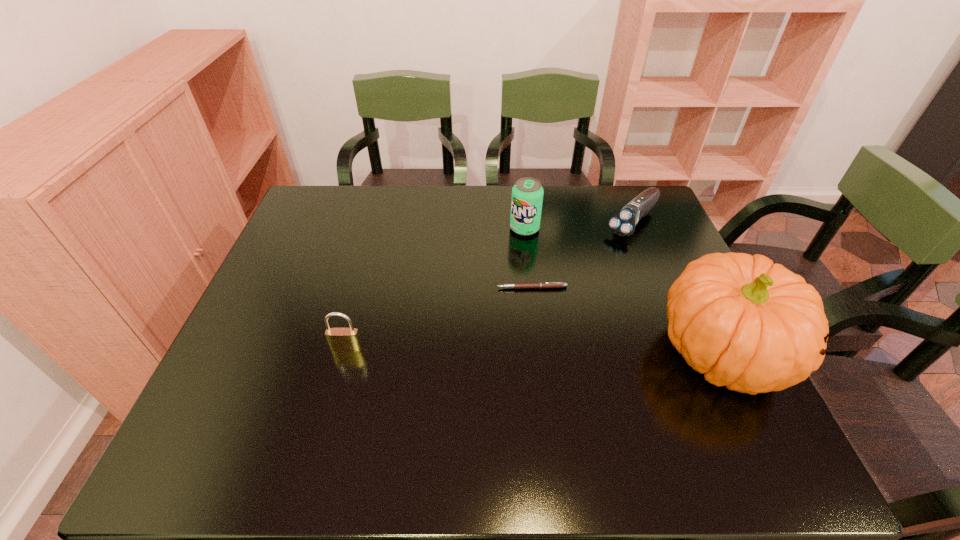
Locate an element on the screen. vacant space at the near right corner is located at coordinates (710, 407).

I want to click on empty location between the electric shaver and the leftmost object, so click(x=490, y=285).

The image size is (960, 540). Find the location of `free space between the pop soda and the padlock`. free space between the pop soda and the padlock is located at coordinates (436, 288).

Find the location of `free space between the electric shaver and the pen`. free space between the electric shaver and the pen is located at coordinates (582, 255).

I want to click on free space between the fourth tallest object and the fourth shortest object, so click(x=579, y=225).

At what (x,y) coordinates should I click in order to perform the action: click on vacant point located between the third shortest object and the pop soda. Please return your answer as a coordinate pair (x, y). Looking at the image, I should click on (436, 288).

This screenshot has width=960, height=540. In order to click on free space that is in between the pumpkin and the shortest object in this screenshot , I will do `click(628, 321)`.

Locate an element on the screen. The image size is (960, 540). free space between the shortest object and the tallest object is located at coordinates (628, 321).

At what (x,y) coordinates should I click in order to perform the action: click on vacant space in between the pop soda and the padlock. Please return your answer as a coordinate pair (x, y). Looking at the image, I should click on (436, 288).

Identify the location of vacant area between the third shortest object and the fourth tallest object. The width and height of the screenshot is (960, 540). (490, 285).